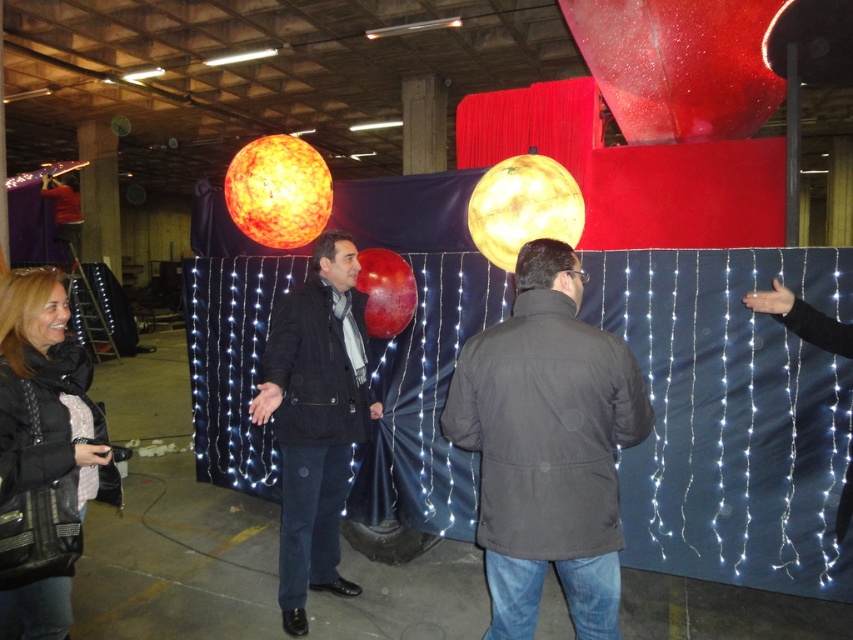
Does dark gray jacket at center have a smaller size compared to black quilted leather jacket at lower left?

No.

Which of these two, dark gray jacket at center or black quilted leather jacket at lower left, stands shorter?

black quilted leather jacket at lower left

Measure the distance between dark gray jacket at center and camera.

dark gray jacket at center and camera are 6.51 feet apart.

Locate an element on the screen. The height and width of the screenshot is (640, 853). dark gray jacket at center is located at coordinates (547, 445).

Which of these two, dark gray jacket at center or matte black jacket at center, stands shorter?

With less height is dark gray jacket at center.

You are a GUI agent. You are given a task and a screenshot of the screen. Output one action in this format:
    pyautogui.click(x=<x>, y=<y>)
    Task: Click on the dark gray jacket at center
    This screenshot has height=640, width=853.
    Given the screenshot: What is the action you would take?
    pyautogui.click(x=547, y=445)

Where is `dark gray jacket at center`? This screenshot has height=640, width=853. dark gray jacket at center is located at coordinates (547, 445).

Does black quilted leather jacket at lower left appear under matte black jacket at center?

Incorrect, black quilted leather jacket at lower left is not positioned below matte black jacket at center.

Is black quilted leather jacket at lower left above matte black jacket at center?

Yes, black quilted leather jacket at lower left is above matte black jacket at center.

Image resolution: width=853 pixels, height=640 pixels. I want to click on black quilted leather jacket at lower left, so click(44, 456).

Find the location of a particular element. black quilted leather jacket at lower left is located at coordinates [44, 456].